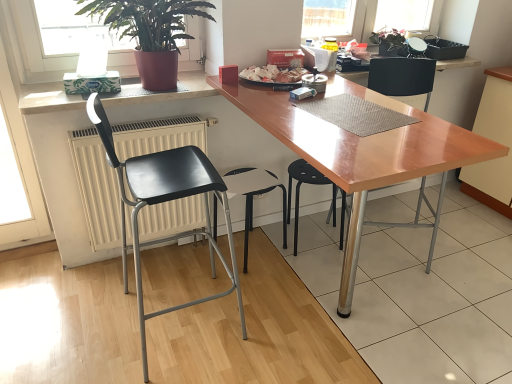
Question: From their relative heights in the image, would you say white matte radiator at left is taller or shorter than black plastic stool at center, positioned as the third chair in right-to-left order?

Choices:
 (A) tall
 (B) short

Answer: (A)

Question: Is white matte radiator at left spatially inside black plastic stool at center, positioned as the 2th chair in left-to-right order, or outside of it?

Choices:
 (A) inside
 (B) outside

Answer: (B)

Question: Estimate the real-world distances between objects in this image. Which object is closer to the white matte counter top at upper left?

Choices:
 (A) white glossy plate at center
 (B) matte black chair at center, which is counted as the 1th chair, starting from the right
 (C) black matte chair at left, acting as the 1th chair starting from the left
 (D) green glossy plant at upper left, which appears as the 1th houseplant when viewed from the left
 (E) black plastic stool at center, the 3th chair in the left-to-right sequence

Answer: (D)

Question: Which of these objects is positioned closest to the white glossy plate at center?

Choices:
 (A) white matte counter top at upper left
 (B) black plastic stool at center, positioned as the third chair in right-to-left order
 (C) green glossy plant at upper left, which is counted as the second houseplant, starting from the back
 (D) matte black chair at center, arranged as the fourth chair when viewed from the left
 (E) black plastic stool at center, the 3th chair in the left-to-right sequence

Answer: (C)